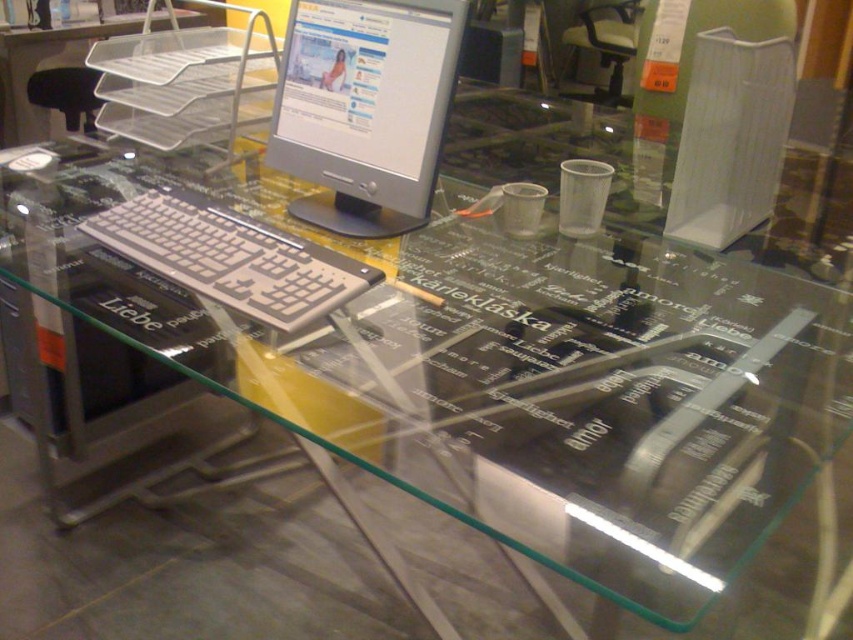
Question: Is silver metallic computer monitor at upper center bigger than silver metallic keyboard at center?

Choices:
 (A) yes
 (B) no

Answer: (A)

Question: Where is silver metallic computer monitor at upper center located in relation to silver metallic keyboard at center in the image?

Choices:
 (A) left
 (B) right

Answer: (B)

Question: Which of the following is the closest to the observer?

Choices:
 (A) silver metallic keyboard at center
 (B) silver metallic computer monitor at upper center

Answer: (A)

Question: Considering the relative positions of silver metallic computer monitor at upper center and silver metallic keyboard at center in the image provided, where is silver metallic computer monitor at upper center located with respect to silver metallic keyboard at center?

Choices:
 (A) below
 (B) above

Answer: (B)